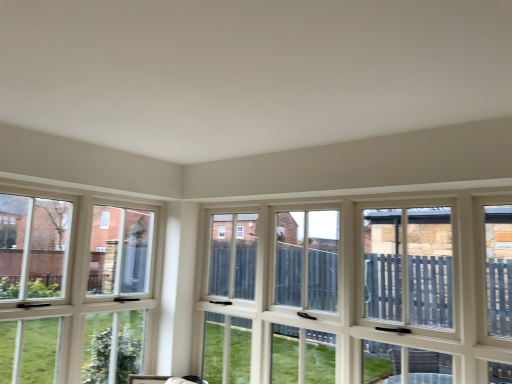
Question: Does point (399, 281) appear closer or farther from the camera than point (53, 294)?

Choices:
 (A) farther
 (B) closer

Answer: (B)

Question: From the image's perspective, is white wood window at center, the second window when ordered from left to right, located above or below white wood window at left, the first window viewed from the left?

Choices:
 (A) below
 (B) above

Answer: (A)

Question: Considering their positions, is white wood window at center, which is the 1th window from right to left, located in front of or behind white wood window at left, which is the 2th window from right to left?

Choices:
 (A) behind
 (B) front

Answer: (B)

Question: Is white wood window at left, the first window viewed from the left, inside or outside of white wood window at center, the second window when ordered from left to right?

Choices:
 (A) outside
 (B) inside

Answer: (A)

Question: Would you say white wood window at left, the first window viewed from the left, is to the left or to the right of white wood window at center, which is the 1th window from right to left, in the picture?

Choices:
 (A) left
 (B) right

Answer: (A)

Question: Considering the positions of white wood window at left, which is the 2th window from right to left, and white wood window at center, the second window when ordered from left to right, in the image, is white wood window at left, which is the 2th window from right to left, wider or thinner than white wood window at center, the second window when ordered from left to right,?

Choices:
 (A) wide
 (B) thin

Answer: (B)

Question: From the image's perspective, relative to white wood window at center, which is the 1th window from right to left, is white wood window at left, the first window viewed from the left, above or below?

Choices:
 (A) above
 (B) below

Answer: (A)